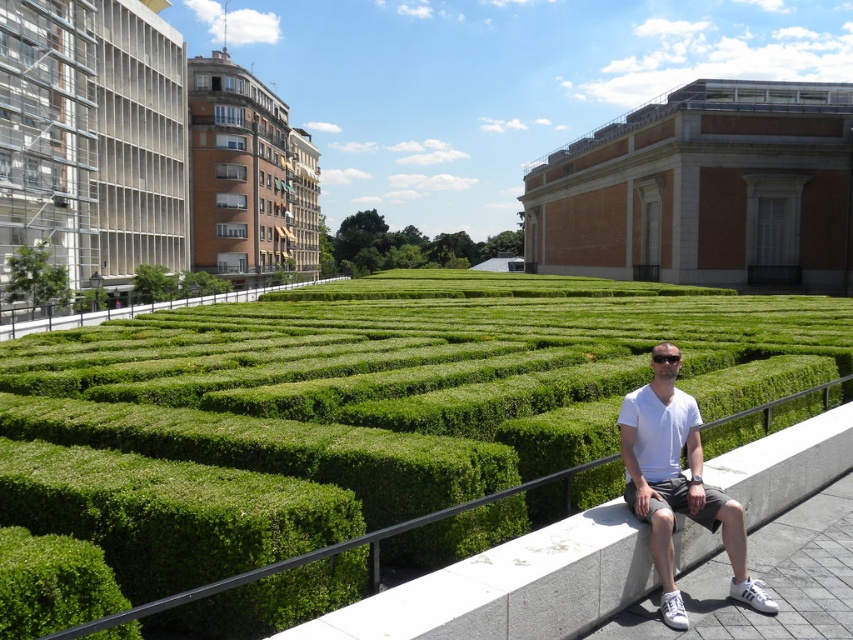
Question: Which point is farther from the camera taking this photo?

Choices:
 (A) (55, 598)
 (B) (171, 289)
 (C) (70, 488)
 (D) (677, 532)

Answer: (B)

Question: Estimate the real-world distances between objects in this image. Which object is closer to the green hedge maze at center?

Choices:
 (A) green leafy bush at center
 (B) green leafy bush at lower left
 (C) white cotton shirt at right
 (D) gray concrete ledge at center

Answer: (B)

Question: Which object is farther from the camera taking this photo?

Choices:
 (A) gray concrete ledge at center
 (B) green leafy bush at lower left

Answer: (A)

Question: Can you confirm if green hedge maze at center is smaller than green leafy bush at center?

Choices:
 (A) no
 (B) yes

Answer: (A)

Question: Can you confirm if green hedge maze at center is positioned to the right of green leafy bush at center?

Choices:
 (A) no
 (B) yes

Answer: (B)

Question: Does green hedge maze at center appear over green leafy bush at center?

Choices:
 (A) yes
 (B) no

Answer: (B)